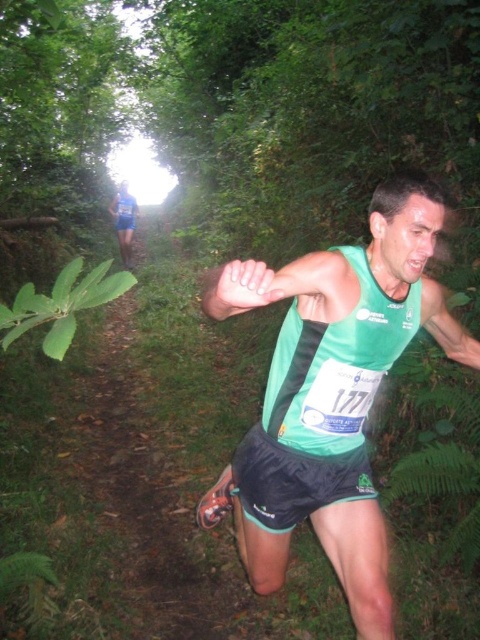
You are a photographer at the trail running event. You want to capture a closeup of the green fabric tank top at center. The camera you are using has a focal length of 100mm. The point at coordinates point (332, 394) is on the green fabric tank top at center. Where should you aim the camera to ensure the green fabric tank top at center is in focus?

The point at coordinates point (332, 394) is on the green fabric tank top at center, so you should aim the camera at that point to ensure the green fabric tank top at center is in focus.

You are a photographer at the trail race. You need to capture a photo of the runner wearing the green fabric tank top at center and black synthetic shorts at center. Based on their positions, which clothing item will appear higher in the photo?

The green fabric tank top at center is located above the black synthetic shorts at center, so the green fabric tank top at center will appear higher in the photo.